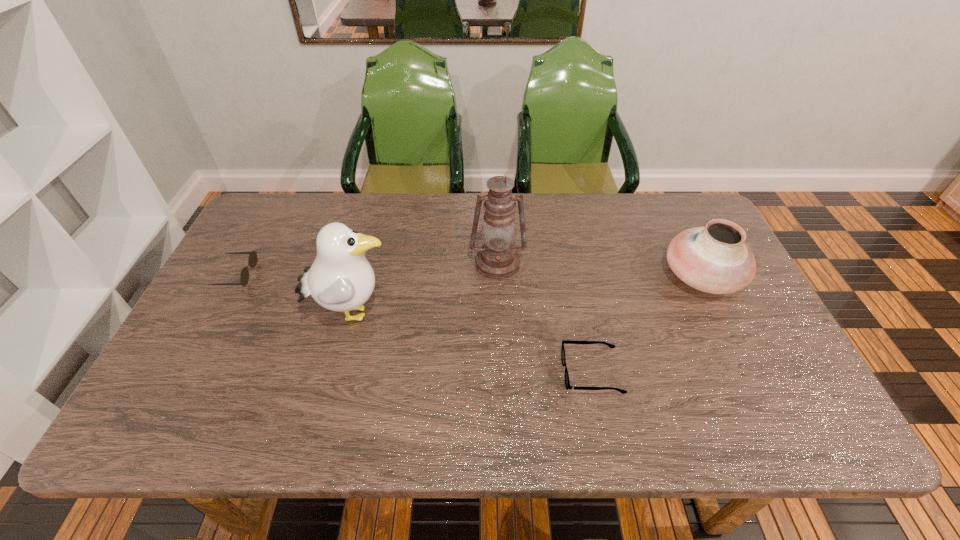
Identify the location of vacant space at the far right corner of the desktop. (686, 192).

In the image, there is a desktop. Where is `vacant space at the near right corner`? vacant space at the near right corner is located at coordinates (824, 438).

Locate an element on the screen. Image resolution: width=960 pixels, height=540 pixels. vacant point located between the nearest object and the pottery is located at coordinates (647, 325).

Locate an element on the screen. free space between the second object from left to right and the nearest object is located at coordinates (471, 343).

Where is `free space between the nearest object and the fourth object from right to left`? The height and width of the screenshot is (540, 960). free space between the nearest object and the fourth object from right to left is located at coordinates (471, 343).

Identify the location of free spot between the third shortest object and the nearest object. The height and width of the screenshot is (540, 960). (647, 325).

The height and width of the screenshot is (540, 960). I want to click on vacant space in between the third object from left to right and the second object from left to right, so click(424, 288).

Locate an element on the screen. The image size is (960, 540). empty space between the spectacles and the sunglasses is located at coordinates (414, 323).

Find the location of a particular element. This screenshot has width=960, height=540. empty space that is in between the fourth object from left to right and the gull is located at coordinates (471, 343).

Locate an element on the screen. The width and height of the screenshot is (960, 540). free space that is in between the third tallest object and the nearest object is located at coordinates (647, 325).